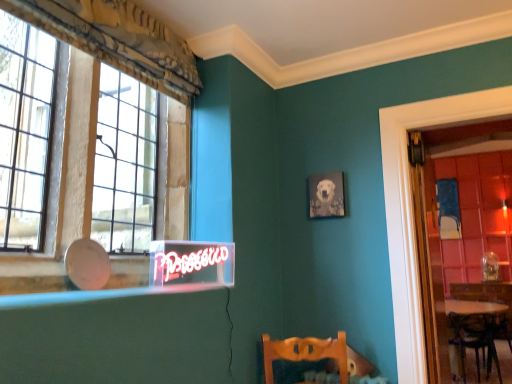
Based on the photo, what is the approximate width of glass paneled window at left?

glass paneled window at left is 22.02 centimeters wide.

Identify the location of glass paneled window at left. point(104,161).

Identify the location of wooden round table at lower right. The height and width of the screenshot is (384, 512). (465, 332).

Locate an element on the screen. This screenshot has width=512, height=384. matte gray canvas at upper center is located at coordinates (326, 195).

I want to click on clear glass door at right, so click(463, 236).

In terms of height, does matte gray canvas at upper center look taller or shorter compared to matte glass window sill at lower left?

Clearly, matte gray canvas at upper center is taller compared to matte glass window sill at lower left.

Is point (327, 178) more distant than point (164, 290)?

That is True.

In terms of size, does wooden round table at lower right appear bigger or smaller than matte glass window sill at lower left?

Clearly, wooden round table at lower right is larger in size than matte glass window sill at lower left.

Is matte glass window sill at lower left at the back of wooden round table at lower right?

Yes, wooden round table at lower right is positioned with its back facing matte glass window sill at lower left.

Would you say wooden round table at lower right is outside matte glass window sill at lower left?

wooden round table at lower right lies outside matte glass window sill at lower left's area.

From a real-world perspective, is wooden round table at lower right below matte glass window sill at lower left?

Yes, from a real-world perspective, wooden round table at lower right is below matte glass window sill at lower left.

Who is smaller, matte glass window sill at lower left or clear glass door at right?

Smaller between the two is matte glass window sill at lower left.

Which of these two, matte glass window sill at lower left or clear glass door at right, stands shorter?

Standing shorter between the two is matte glass window sill at lower left.

From a real-world perspective, does matte glass window sill at lower left sit lower than clear glass door at right?

Yes.

Considering the sizes of objects glass paneled window at left and matte gray canvas at upper center in the image provided, who is thinner, glass paneled window at left or matte gray canvas at upper center?

With smaller width is matte gray canvas at upper center.

Could you tell me if glass paneled window at left is facing matte gray canvas at upper center?

No, glass paneled window at left is not facing towards matte gray canvas at upper center.

From a real-world perspective, which is physically below, glass paneled window at left or matte gray canvas at upper center?

matte gray canvas at upper center.

Which is behind, glass paneled window at left or matte gray canvas at upper center?

Positioned behind is matte gray canvas at upper center.

From the picture: From the image's perspective, is matte gray canvas at upper center over wooden round table at lower right?

Yes, from the image's perspective, matte gray canvas at upper center is over wooden round table at lower right.

Considering the relative sizes of matte gray canvas at upper center and wooden round table at lower right in the image provided, is matte gray canvas at upper center thinner than wooden round table at lower right?

Indeed, matte gray canvas at upper center has a lesser width compared to wooden round table at lower right.

Do you think matte gray canvas at upper center is within wooden round table at lower right, or outside of it?

matte gray canvas at upper center exists outside the volume of wooden round table at lower right.

From a real-world perspective, is matte gray canvas at upper center on wooden round table at lower right?

Yes, from a real-world perspective, matte gray canvas at upper center is on top of wooden round table at lower right.

From the image's perspective, would you say clear glass door at right is positioned over matte glass window sill at lower left?

Yes, from the image's perspective, clear glass door at right is over matte glass window sill at lower left.

Is clear glass door at right closer to the viewer compared to matte glass window sill at lower left?

No, clear glass door at right is behind matte glass window sill at lower left.

From a real-world perspective, which object rests below the other?

From a 3D spatial view, matte glass window sill at lower left is below.

From the image's perspective, is matte gray canvas at upper center located above clear glass door at right?

Yes.

Where is `glass door in front of the matte gray canvas at upper center`? glass door in front of the matte gray canvas at upper center is located at coordinates (463, 236).

Is matte gray canvas at upper center bigger or smaller than clear glass door at right?

Considering their sizes, matte gray canvas at upper center takes up less space than clear glass door at right.

What's the angular difference between matte gray canvas at upper center and clear glass door at right's facing directions?

They differ by 0.364 degrees in their facing directions.

Identify the location of window sill in front of the matte gray canvas at upper center. click(x=100, y=294).

The width and height of the screenshot is (512, 384). Find the location of `window sill on the left of wooden round table at lower right`. window sill on the left of wooden round table at lower right is located at coordinates (100, 294).

Consider the image. Estimate the real-world distances between objects in this image. Which object is closer to glass paneled window at left, matte glass window sill at lower left or wooden round table at lower right?

matte glass window sill at lower left is closer to glass paneled window at left.

Estimate the real-world distances between objects in this image. Which object is closer to wooden round table at lower right, glass paneled window at left or clear glass door at right?

The object closer to wooden round table at lower right is clear glass door at right.

Consider the image. Estimate the real-world distances between objects in this image. Which object is further from wooden round table at lower right, matte gray canvas at upper center or glass paneled window at left?

glass paneled window at left is positioned further to the anchor wooden round table at lower right.

When comparing their distances from clear glass door at right, does matte glass window sill at lower left or wooden round table at lower right seem further?

matte glass window sill at lower left lies further to clear glass door at right than the other object.

When comparing their distances from matte gray canvas at upper center, does glass paneled window at left or wooden round table at lower right seem closer?

wooden round table at lower right lies closer to matte gray canvas at upper center than the other object.

Based on their spatial positions, is wooden round table at lower right or clear glass door at right closer to glass paneled window at left?

Based on the image, clear glass door at right appears to be nearer to glass paneled window at left.

From the image, which object appears to be farther from clear glass door at right, wooden round table at lower right or matte glass window sill at lower left?

matte glass window sill at lower left is further to clear glass door at right.

Considering their positions, is matte glass window sill at lower left positioned closer to wooden round table at lower right than clear glass door at right?

Among the two, clear glass door at right is located nearer to wooden round table at lower right.

Where is `window positioned between matte glass window sill at lower left and matte gray canvas at upper center from near to far`? window positioned between matte glass window sill at lower left and matte gray canvas at upper center from near to far is located at coordinates (104, 161).

Identify the location of picture frame located between clear glass door at right and wooden round table at lower right in the depth direction. This screenshot has width=512, height=384. (326, 195).

Locate an element on the screen. The image size is (512, 384). glass door situated between glass paneled window at left and wooden round table at lower right from left to right is located at coordinates (463, 236).

The width and height of the screenshot is (512, 384). Find the location of `picture frame between matte glass window sill at lower left and clear glass door at right from left to right`. picture frame between matte glass window sill at lower left and clear glass door at right from left to right is located at coordinates (326, 195).